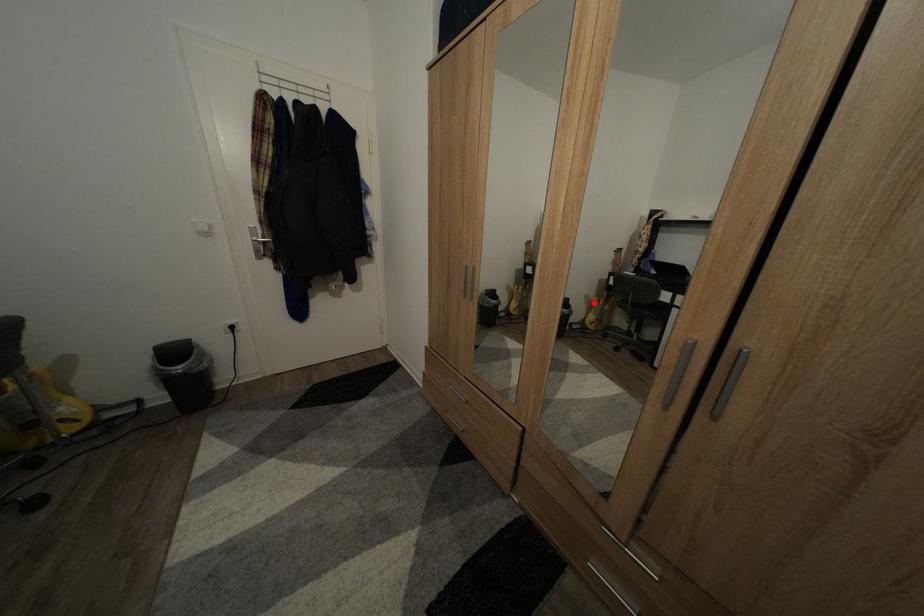
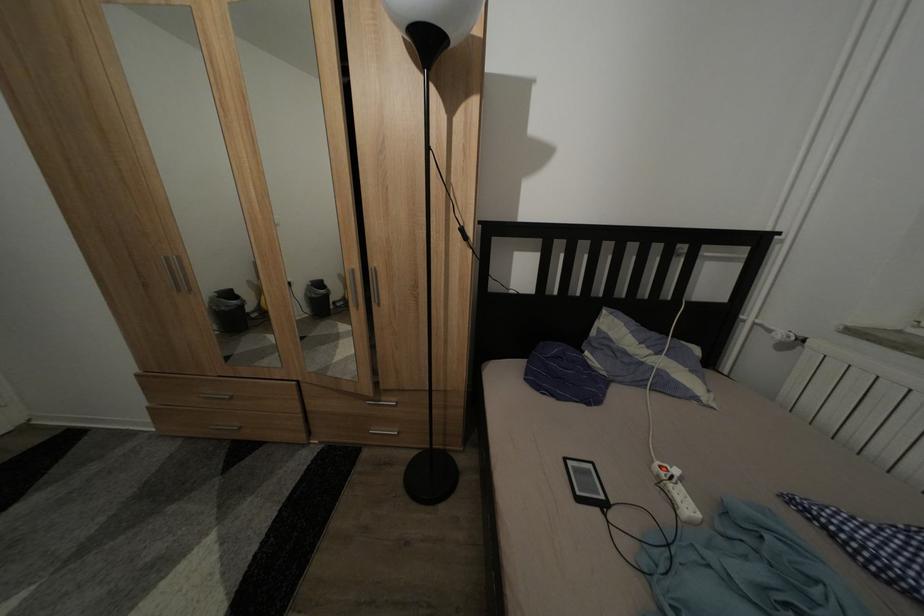
Question: I am providing you with two images of the same scene from different viewpoints. A red point is marked on the first image. Is the red point's position out of view in image 2?

Choices:
 (A) Yes
 (B) No

Answer: (B)